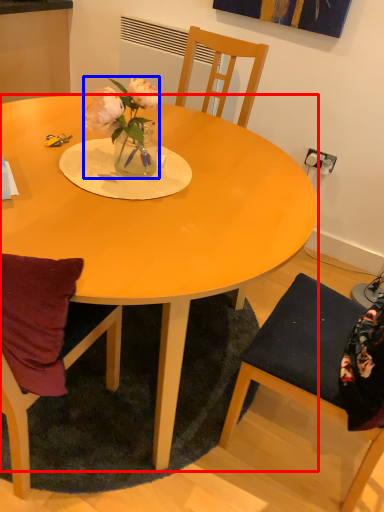
Question: Which object is closer to the camera taking this photo, desk (highlighted by a red box) or houseplant (highlighted by a blue box)?

Choices:
 (A) desk
 (B) houseplant

Answer: (A)